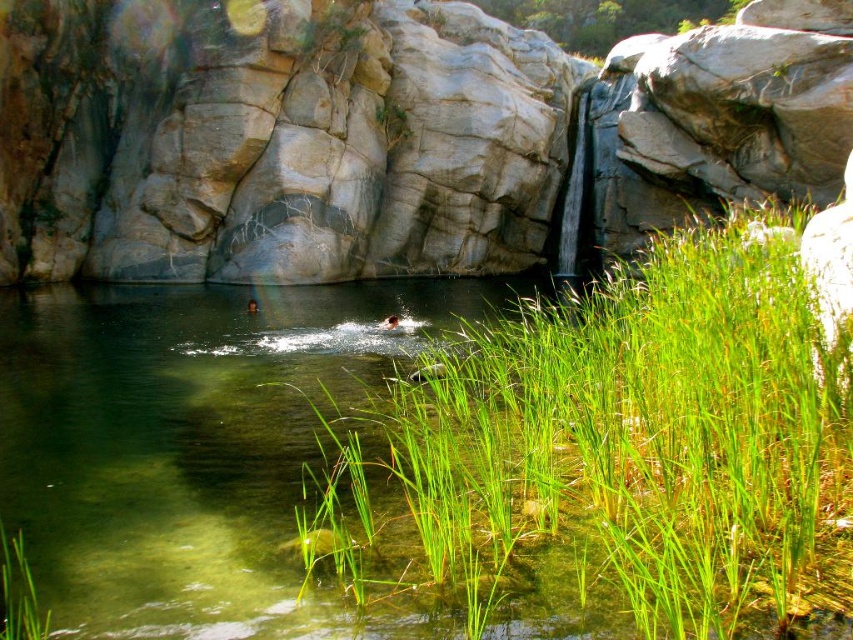
You are standing at the edge of the pool and want to walk towards the green grass at center. However, there is another green grass at lower left in your path. Which grass should you step on first?

The green grass at center is in front of green grass at lower left, so you should step on the green grass at center first before reaching the green grass at lower left.